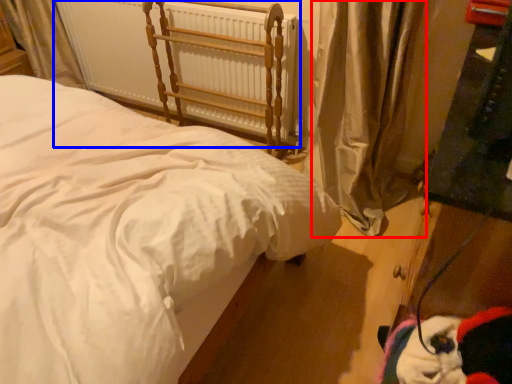
Question: Among these objects, which one is nearest to the camera, curtain (highlighted by a red box) or radiator (highlighted by a blue box)?

Choices:
 (A) curtain
 (B) radiator

Answer: (A)